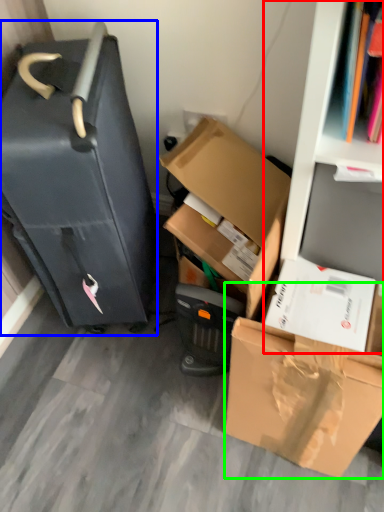
Question: Estimate the real-world distances between objects in this image. Which object is closer to bookshelf (highlighted by a red box), suitcase (highlighted by a blue box) or box (highlighted by a green box)?

Choices:
 (A) suitcase
 (B) box

Answer: (B)